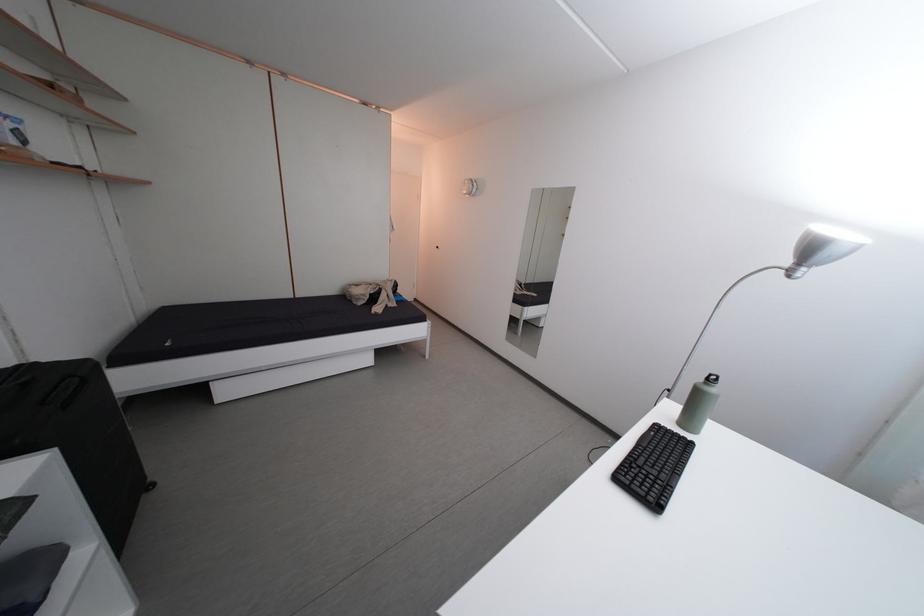
Image resolution: width=924 pixels, height=616 pixels. I want to click on black bottle cap, so click(711, 379).